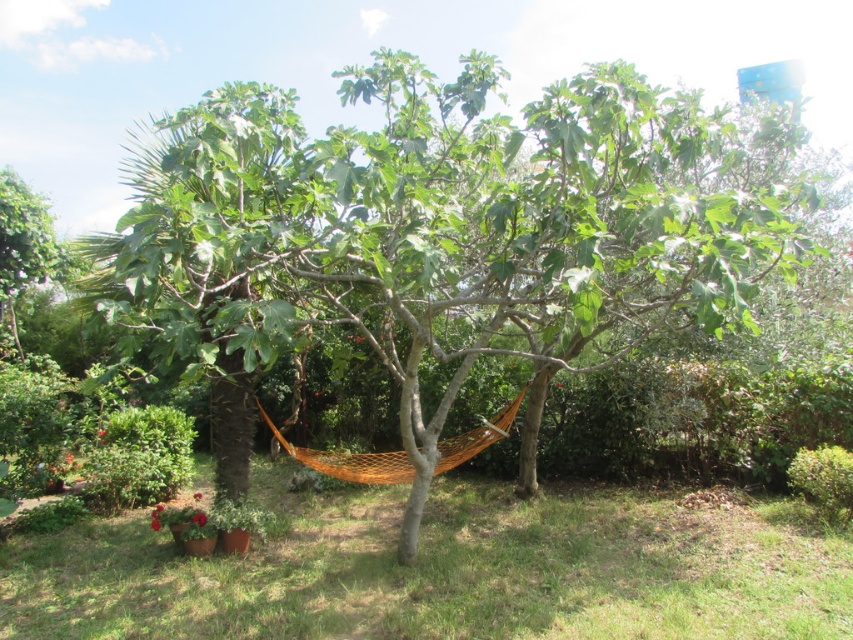
You are planning to set up a picnic blanket under the green leafy tree at center and the orange mesh hammock at center. Can you place the blanket directly below both objects without any obstruction?

The green leafy tree at center is above the orange mesh hammock at center, so placing the picnic blanket directly below both would require positioning it under the orange mesh hammock at center. However, the hammock itself may obstruct the area directly beneath the tree, so ensure there is enough space between them for the blanket.

You are standing at the point marked by the coordinates point [444,230] in the garden. Looking around, you see the green leafy tree at center. Which direction should you walk to reach the orange hammock suspended between two sturdy branches of this tree?

The point [444,230] indicates the green leafy tree at center. Since the orange hammock is suspended between two sturdy branches of this tree, you are already at the tree where the hammock is located. Therefore, you should look up or move towards the branches where the hammock is suspended rather than walking in any direction.

You are standing in the garden and want to take a photo of the green leafy tree at center and the orange mesh hammock at center. Which object should you focus on first if you want both to be in sharp focus?

Since the green leafy tree at center is closer to the viewer than the orange mesh hammock at center, you should focus on the green leafy tree at center first to ensure both are in sharp focus.